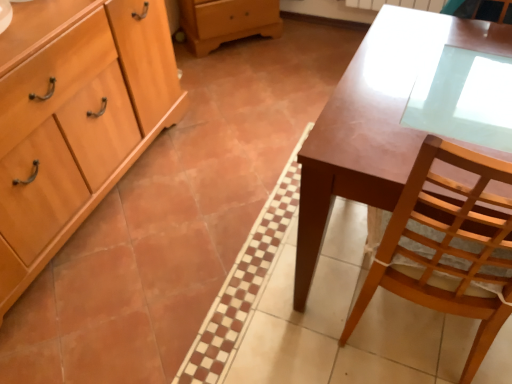
At what (x,y) coordinates should I click in order to perform the action: click on free space in front of light wood cabinet at left. Please return your answer as a coordinate pair (x, y). This screenshot has width=512, height=384. Looking at the image, I should click on (120, 301).